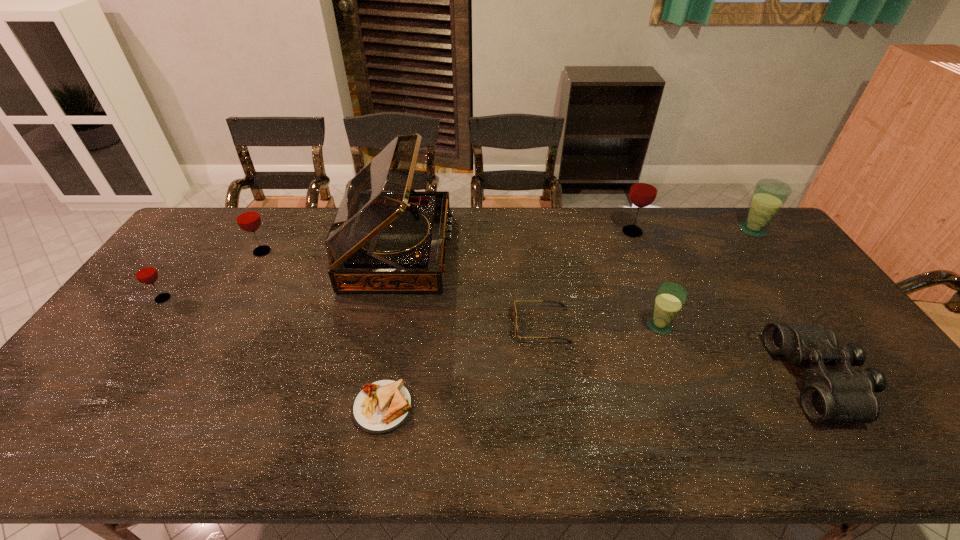
Locate an element on the screen. Image resolution: width=960 pixels, height=540 pixels. record player that is at the far edge is located at coordinates (385, 237).

The height and width of the screenshot is (540, 960). What are the coordinates of `binoculars that is at the near edge` in the screenshot? It's located at (843, 395).

Find the location of a particular element. sandwich located at the near edge is located at coordinates (380, 407).

Locate an element on the screen. This screenshot has height=540, width=960. object present at the left edge is located at coordinates (143, 270).

Identify the location of glass positioned at the right edge. (769, 195).

Where is `binoculars that is at the right edge`? binoculars that is at the right edge is located at coordinates (843, 395).

In order to click on object that is at the far right corner in this screenshot , I will do `click(769, 195)`.

Locate an element on the screen. The width and height of the screenshot is (960, 540). object that is at the near right corner is located at coordinates (843, 395).

In the image, there is a desktop. At what (x,y) coordinates should I click in order to perform the action: click on free space at the far edge. Please return your answer as a coordinate pair (x, y). The width and height of the screenshot is (960, 540). Looking at the image, I should click on (475, 218).

I want to click on vacant region at the near edge, so click(558, 444).